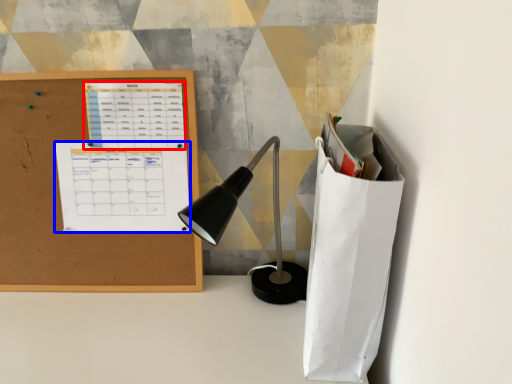
Question: Among these objects, which one is nearest to the camera, notebook (highlighted by a red box) or notebook (highlighted by a blue box)?

Choices:
 (A) notebook
 (B) notebook

Answer: (A)